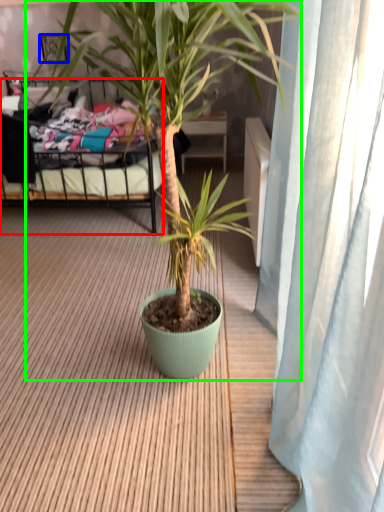
Question: Based on their relative distances, which object is farther from bed (highlighted by a red box)? Choose from picture frame (highlighted by a blue box) and houseplant (highlighted by a green box).

Choices:
 (A) picture frame
 (B) houseplant

Answer: (B)